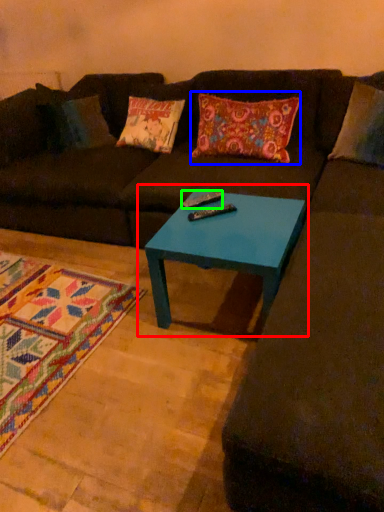
Question: Estimate the real-world distances between objects in this image. Which object is farther from coffee table (highlighted by a red box), throw pillow (highlighted by a blue box) or remote (highlighted by a green box)?

Choices:
 (A) throw pillow
 (B) remote

Answer: (A)